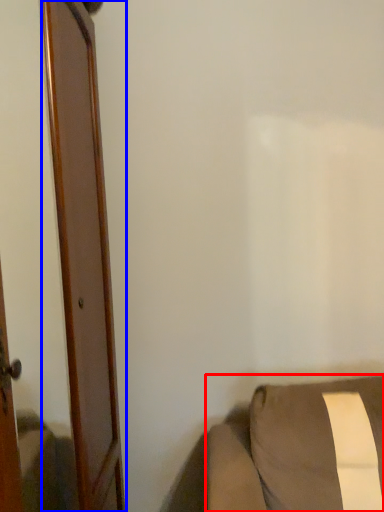
Question: Which object is closer to the camera taking this photo, furniture (highlighted by a red box) or door (highlighted by a blue box)?

Choices:
 (A) furniture
 (B) door

Answer: (B)